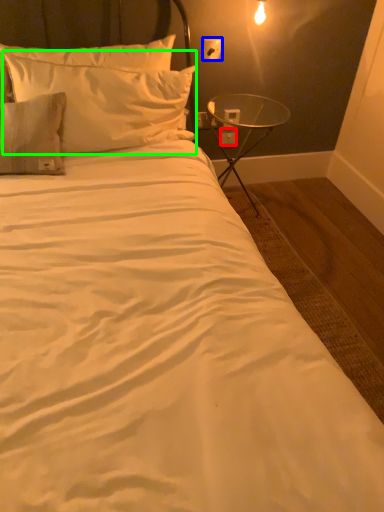
Question: Based on their relative distances, which object is farther from electric outlet (highlighted by a red box)? Choose from electric outlet (highlighted by a blue box) and pillow (highlighted by a green box).

Choices:
 (A) electric outlet
 (B) pillow

Answer: (B)